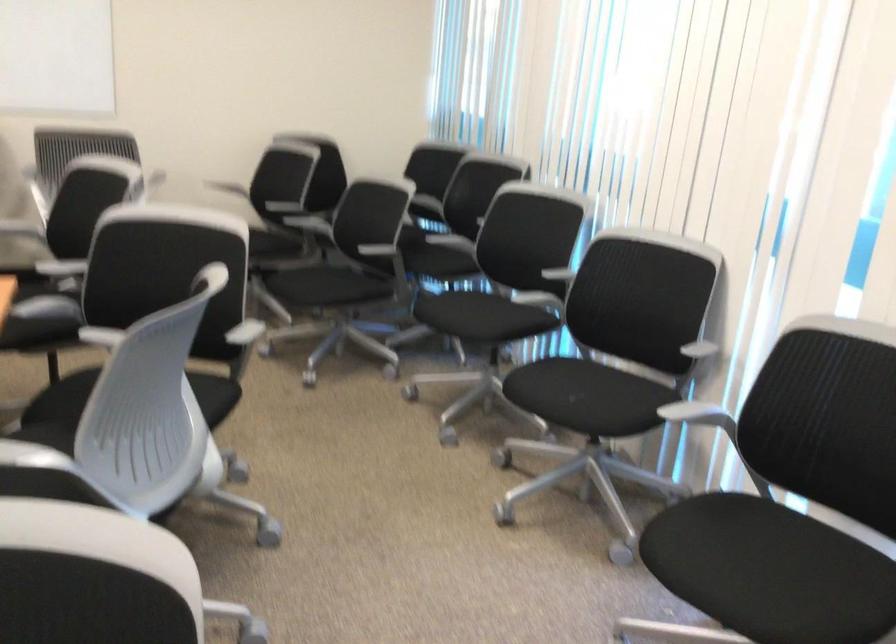
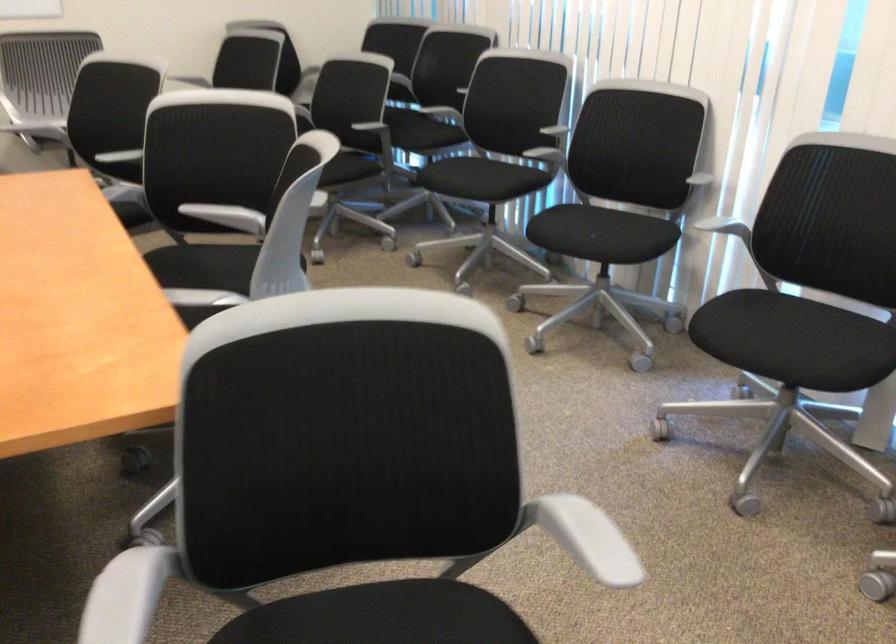
Locate, in the second image, the point that corresponds to [560,399] in the first image.

(582, 232)